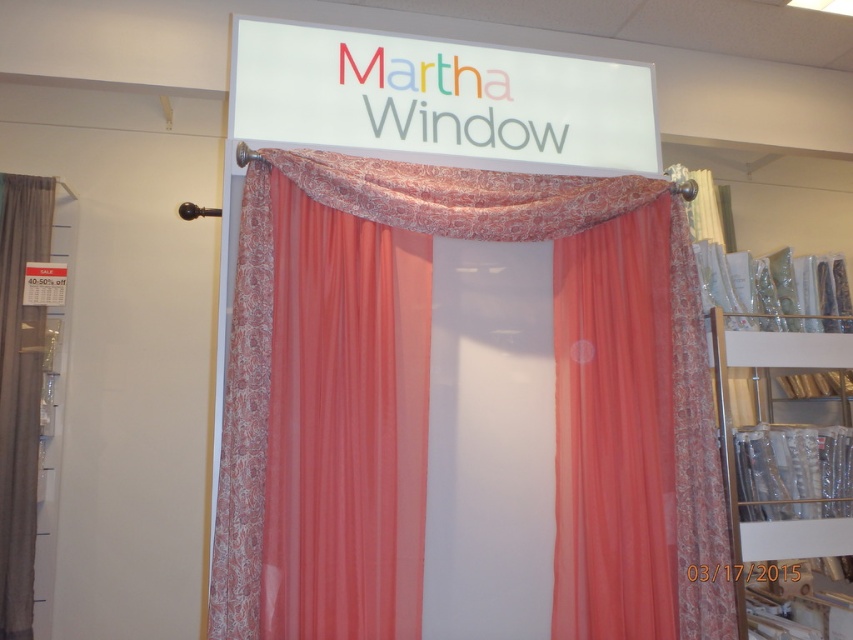
Question: From the image, what is the correct spatial relationship of coral sheer curtain at center in relation to matte gray curtain at left?

Choices:
 (A) right
 (B) left

Answer: (A)

Question: Which of these objects is positioned farthest from the metallic gold bookshelf at right?

Choices:
 (A) matte gray curtain at left
 (B) coral sheer curtain at center

Answer: (A)

Question: Which is nearer to the matte gray curtain at left?

Choices:
 (A) metallic gold bookshelf at right
 (B) coral sheer curtain at center

Answer: (B)

Question: In this image, where is coral sheer curtain at center located relative to matte gray curtain at left?

Choices:
 (A) above
 (B) below

Answer: (A)

Question: Estimate the real-world distances between objects in this image. Which object is farther from the matte gray curtain at left?

Choices:
 (A) coral sheer curtain at center
 (B) metallic gold bookshelf at right

Answer: (B)

Question: From the image, what is the correct spatial relationship of metallic gold bookshelf at right in relation to matte gray curtain at left?

Choices:
 (A) below
 (B) above

Answer: (A)